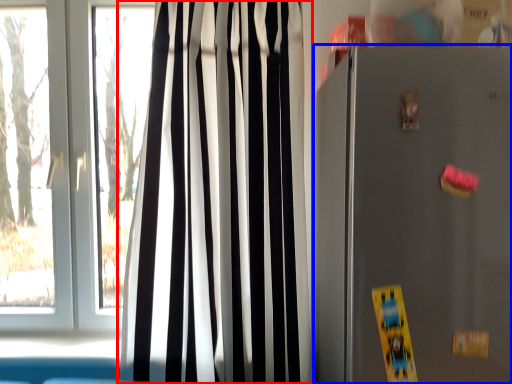
Question: Which point is closer to the camera, curtain (highlighted by a red box) or appliance (highlighted by a blue box)?

Choices:
 (A) curtain
 (B) appliance

Answer: (B)